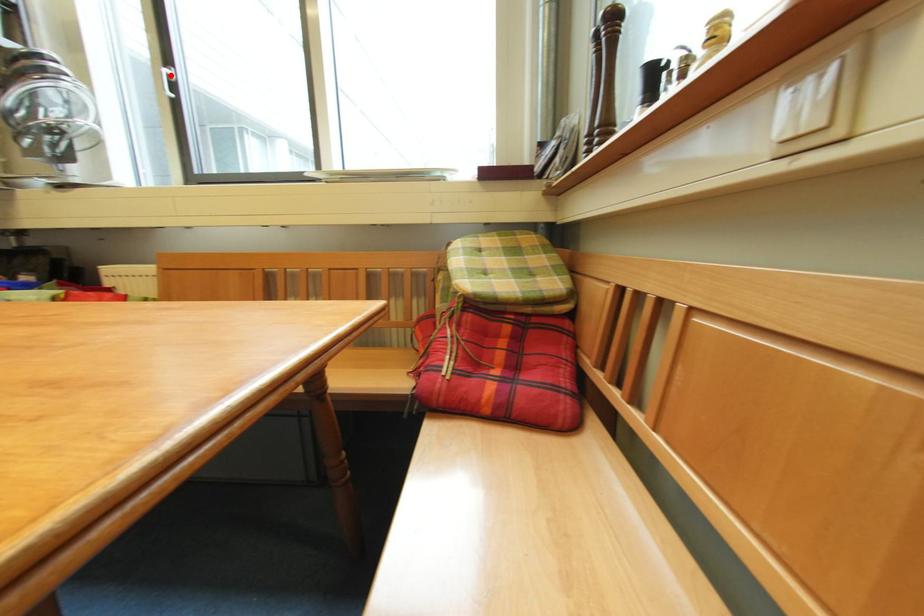
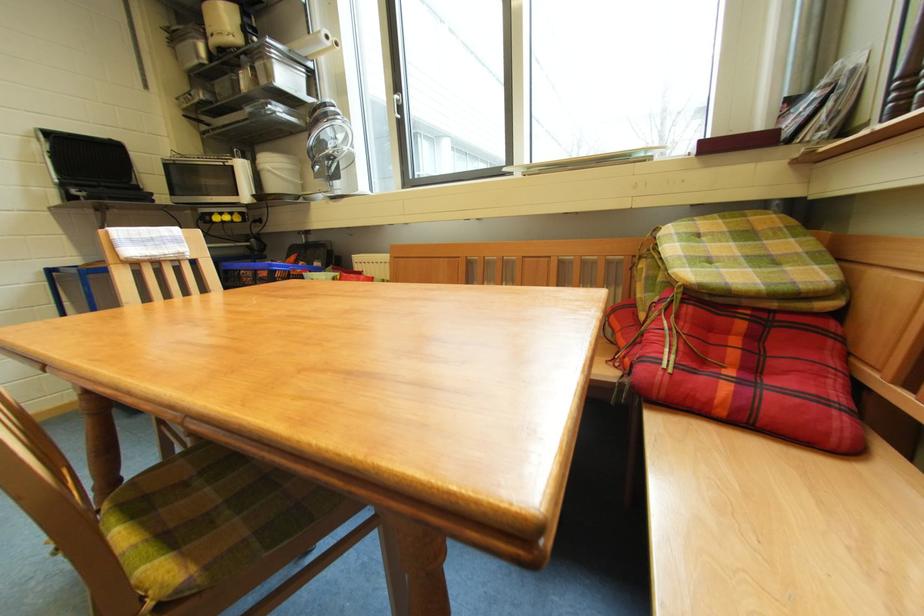
Find the pixel in the second image that matches the highlighted location in the first image.

(402, 102)